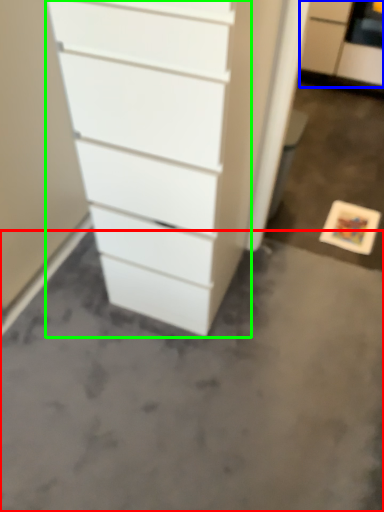
Question: Considering the real-world distances, which object is closest to concrete (highlighted by a red box)? filing cabinet (highlighted by a blue box) or chest of drawers (highlighted by a green box).

Choices:
 (A) filing cabinet
 (B) chest of drawers

Answer: (B)